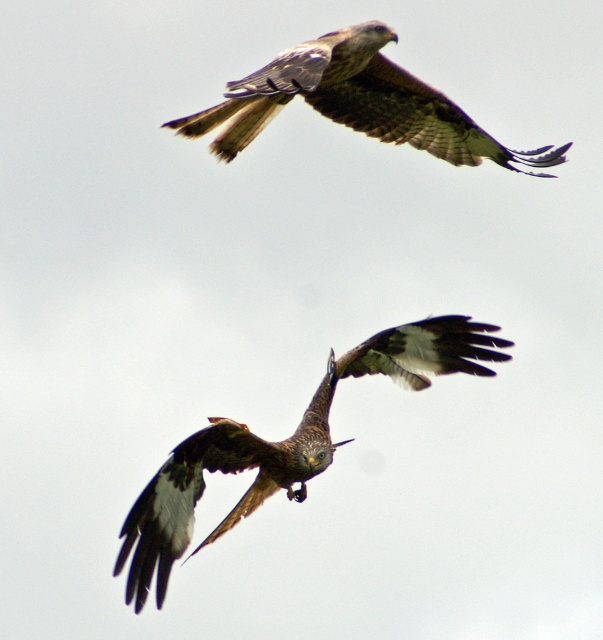
You are a birdwatcher observing two eagles in the sky. You see a brown speckled eagle at center and a brown feathered eagle at upper center. Which eagle is taller?

The brown speckled eagle at center is taller than the brown feathered eagle at upper center.

You are a birdwatcher observing two eagles in the sky. You notice the brown speckled eagle at center and the brown feathered eagle at upper center. Which eagle is positioned lower in the sky?

The brown speckled eagle at center is positioned lower than the brown feathered eagle at upper center.